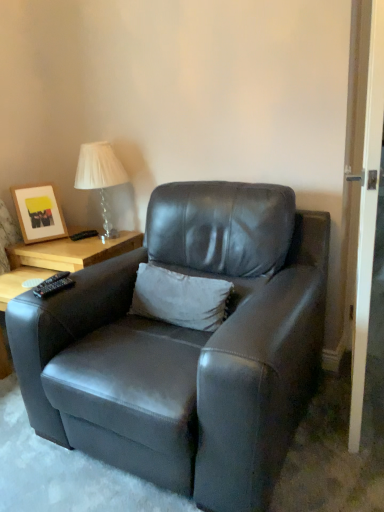
Image resolution: width=384 pixels, height=512 pixels. Identify the location of matte black armchair at center. (186, 347).

What is the approximate width of matte black armchair at center?

It is 3.34 feet.

Describe the element at coordinates (100, 177) in the screenshot. This screenshot has width=384, height=512. I see `clear glass table lamp at upper left` at that location.

At what (x,y) coordinates should I click in order to perform the action: click on clear glass table lamp at upper left. Please return your answer as a coordinate pair (x, y). The width and height of the screenshot is (384, 512). Looking at the image, I should click on (100, 177).

This screenshot has height=512, width=384. What do you see at coordinates (53, 286) in the screenshot?
I see `black plastic remote at lower left` at bounding box center [53, 286].

Measure the distance between matte wooden picture frame at upper left and camera.

matte wooden picture frame at upper left is 7.67 feet away from camera.

Identify the location of matte black armchair at center. coord(186,347).

Does clear glass table lamp at upper left lie behind white soft pillow at center?

That is True.

Considering the sizes of clear glass table lamp at upper left and white soft pillow at center in the image, is clear glass table lamp at upper left bigger or smaller than white soft pillow at center?

clear glass table lamp at upper left is bigger than white soft pillow at center.

Which is nearer, [111,173] or [215,327]?

Positioned in front is point [215,327].

Which of these two, clear glass table lamp at upper left or white wood screen door at right, stands shorter?

clear glass table lamp at upper left.

Is clear glass table lamp at upper left spatially inside white wood screen door at right, or outside of it?

The correct answer is: outside.

Is clear glass table lamp at upper left positioned with its back to white wood screen door at right?

No.

Does point (117, 233) appear closer or farther from the camera than point (369, 116)?

Point (117, 233) appears to be farther away from the viewer than point (369, 116).

Which object is positioned more to the right, matte black armchair at center or matte wooden picture frame at upper left?

matte black armchair at center is more to the right.

From the image's perspective, is matte black armchair at center beneath matte wooden picture frame at upper left?

Yes, from the image's perspective, matte black armchair at center is below matte wooden picture frame at upper left.

Which of these two, matte black armchair at center or matte wooden picture frame at upper left, is smaller?

With smaller size is matte wooden picture frame at upper left.

Looking at this image, from the image's perspective, does white wood screen door at right appear lower than black plastic remote at lower left?

Incorrect, from the image's perspective, white wood screen door at right is higher than black plastic remote at lower left.

Consider the image. How many degrees apart are the facing directions of white wood screen door at right and black plastic remote at lower left?

99.3 degrees.

From a real-world perspective, which object rests below the other?

black plastic remote at lower left.

Between white wood screen door at right and black plastic remote at lower left, which one appears on the right side from the viewer's perspective?

white wood screen door at right.

From the image's perspective, does black plastic remote at lower left appear lower than matte black armchair at center?

No, from the image's perspective, black plastic remote at lower left is not below matte black armchair at center.

Could you tell me if black plastic remote at lower left is turned towards matte black armchair at center?

Yes, black plastic remote at lower left is aimed at matte black armchair at center.

At what (x,y) coordinates should I click in order to perform the action: click on chair that is under the black plastic remote at lower left (from a real-world perspective). Please return your answer as a coordinate pair (x, y). Image resolution: width=384 pixels, height=512 pixels. Looking at the image, I should click on (186, 347).

Who is more distant, black plastic remote at lower left or matte black armchair at center?

black plastic remote at lower left is behind.

How much distance is there between matte wooden picture frame at upper left and black plastic remote at lower left?

33.29 inches.

Locate an element on the screen. picture frame on the left of black plastic remote at lower left is located at coordinates (39, 213).

Is matte wooden picture frame at upper left situated inside black plastic remote at lower left or outside?

matte wooden picture frame at upper left is spatially situated outside black plastic remote at lower left.

Is matte wooden picture frame at upper left turned away from black plastic remote at lower left?

No, matte wooden picture frame at upper left is not facing the opposite direction of black plastic remote at lower left.

Considering the positions of point (284, 237) and point (51, 293), is point (284, 237) closer or farther from the camera than point (51, 293)?

Point (284, 237) appears to be farther away from the viewer than point (51, 293).

Which object is wider, matte black armchair at center or black plastic remote at lower left?

Wider between the two is matte black armchair at center.

Can we say matte black armchair at center lies outside black plastic remote at lower left?

Yes, matte black armchair at center is outside of black plastic remote at lower left.

From the image's perspective, between matte black armchair at center and black plastic remote at lower left, which one is located above?

black plastic remote at lower left appears higher in the image.

In the image, there is a white soft pillow at center. At what (x,y) coordinates should I click in order to perform the action: click on table lamp above it (from the image's perspective). Please return your answer as a coordinate pair (x, y). Image resolution: width=384 pixels, height=512 pixels. Looking at the image, I should click on (100, 177).

Where is `table lamp on the left of white wood screen door at right`? The image size is (384, 512). table lamp on the left of white wood screen door at right is located at coordinates (100, 177).

From the image, which object appears to be farther from black plastic remote at lower left, white wood screen door at right or clear glass table lamp at upper left?

white wood screen door at right.

Considering their positions, is white soft pillow at center positioned further to matte black armchair at center than black plastic remote at lower left?

black plastic remote at lower left.

From the image, which object appears to be nearer to white soft pillow at center, matte wooden picture frame at upper left or matte black armchair at center?

matte black armchair at center is closer to white soft pillow at center.

Looking at the image, which one is located closer to white soft pillow at center, matte black armchair at center or matte wooden picture frame at upper left?

Among the two, matte black armchair at center is located nearer to white soft pillow at center.

Based on their spatial positions, is black plastic remote at lower left or clear glass table lamp at upper left further from white soft pillow at center?

Among the two, clear glass table lamp at upper left is located further to white soft pillow at center.

From the image, which object appears to be nearer to matte black armchair at center, black plastic remote at lower left or matte wooden picture frame at upper left?

black plastic remote at lower left lies closer to matte black armchair at center than the other object.

From the image, which object appears to be nearer to black plastic remote at lower left, clear glass table lamp at upper left or white soft pillow at center?

white soft pillow at center is closer to black plastic remote at lower left.

Considering their positions, is clear glass table lamp at upper left positioned closer to matte black armchair at center than white soft pillow at center?

white soft pillow at center lies closer to matte black armchair at center than the other object.

Locate an element on the screen. chair between white soft pillow at center and white wood screen door at right from left to right is located at coordinates (186, 347).

I want to click on table lamp located between black plastic remote at lower left and white wood screen door at right in the left-right direction, so click(100, 177).

The height and width of the screenshot is (512, 384). I want to click on remote between matte black armchair at center and white soft pillow at center in the front-back direction, so click(x=53, y=286).

The height and width of the screenshot is (512, 384). What are the coordinates of `remote that lies between clear glass table lamp at upper left and white soft pillow at center from top to bottom` in the screenshot? It's located at (53, 286).